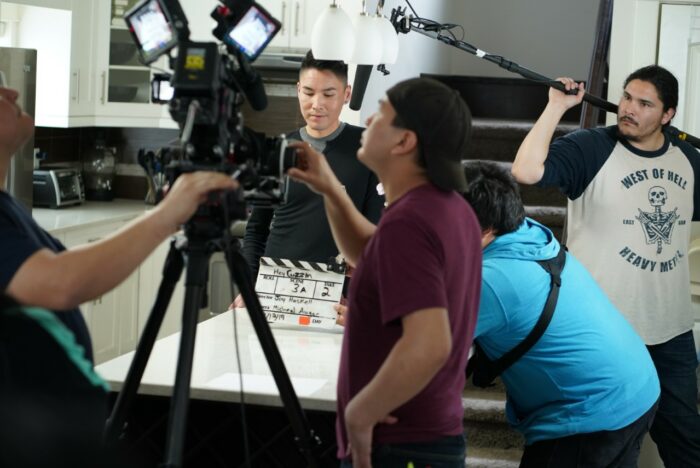
Identify the location of white cabinet above kitchen counter top left side. This screenshot has height=468, width=700. (111, 67).